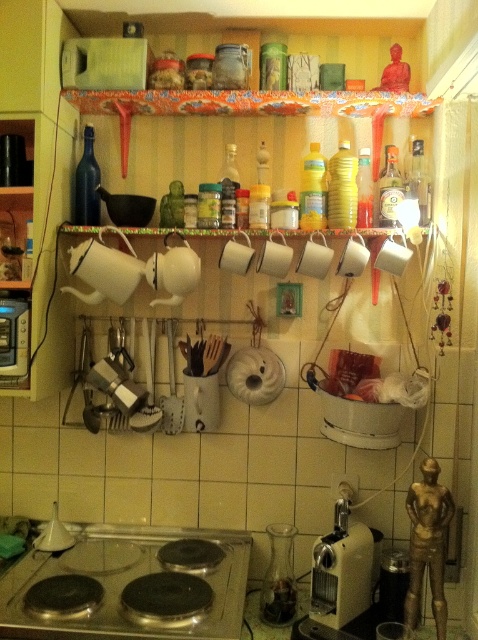
Does black glass stove at lower center appear over metallic silver toaster at left?

Incorrect, black glass stove at lower center is not positioned above metallic silver toaster at left.

Is point (159, 561) closer to viewer compared to point (21, 353)?

No, it is not.

Locate an element on the screen. This screenshot has width=478, height=640. black glass stove at lower center is located at coordinates (130, 586).

Who is positioned more to the left, metallic beige coffee machine at lower center or metallic silver toaster at left?

From the viewer's perspective, metallic silver toaster at left appears more on the left side.

Can you confirm if metallic beige coffee machine at lower center is positioned to the right of metallic silver toaster at left?

Yes, metallic beige coffee machine at lower center is to the right of metallic silver toaster at left.

At what (x,y) coordinates should I click in order to perform the action: click on metallic beige coffee machine at lower center. Please return your answer as a coordinate pair (x, y). Looking at the image, I should click on (341, 570).

Is black glass stove at lower center to the left of metallic beige coffee machine at lower center from the viewer's perspective?

Yes, black glass stove at lower center is to the left of metallic beige coffee machine at lower center.

Who is more forward, (x=77, y=605) or (x=364, y=580)?

Point (x=77, y=605)

This screenshot has width=478, height=640. Identify the location of black glass stove at lower center. (130, 586).